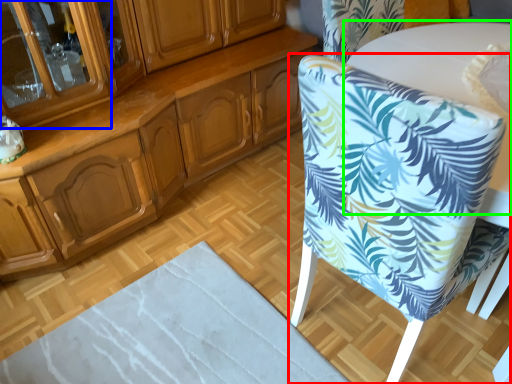
Question: Which is farther away from chair (highlighted by a red box)? glass door (highlighted by a blue box) or round table (highlighted by a green box)?

Choices:
 (A) glass door
 (B) round table

Answer: (A)